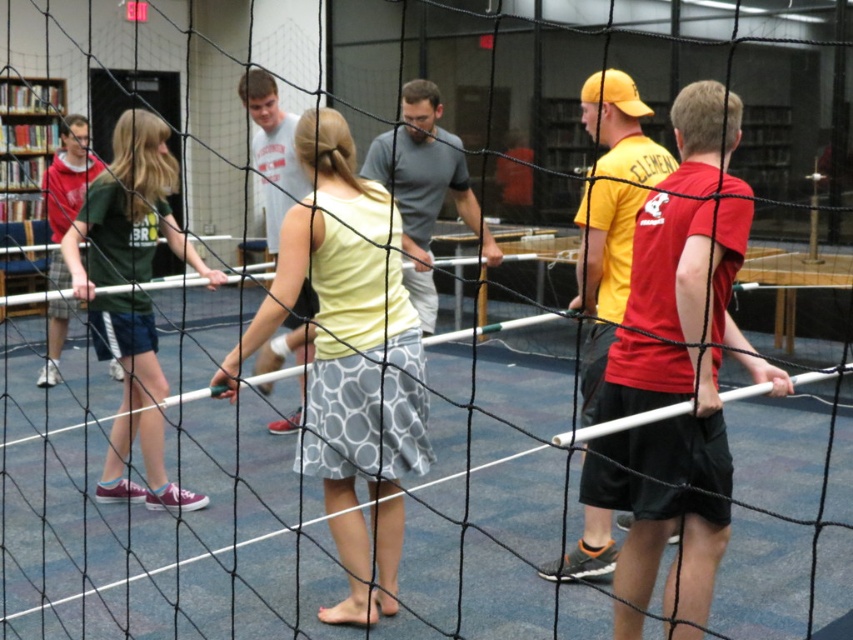
Between light yellow fabric shirt at center and dark green jersey at left, which one has less height?

With less height is dark green jersey at left.

Is light yellow fabric shirt at center shorter than dark green jersey at left?

Incorrect, light yellow fabric shirt at center's height does not fall short of dark green jersey at left's.

Locate an element on the screen. The height and width of the screenshot is (640, 853). light yellow fabric shirt at center is located at coordinates (349, 358).

Locate an element on the screen. The height and width of the screenshot is (640, 853). light yellow fabric shirt at center is located at coordinates (349, 358).